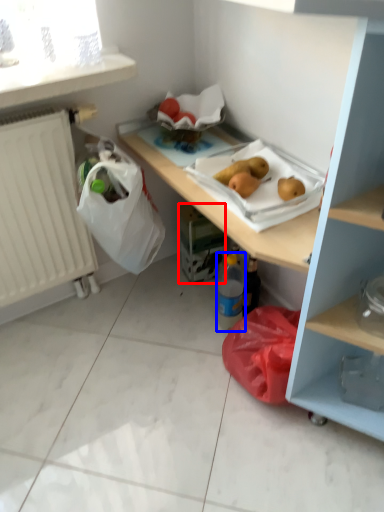
Question: Among these objects, which one is farthest to the camera, carton (highlighted by a red box) or bottle (highlighted by a blue box)?

Choices:
 (A) carton
 (B) bottle

Answer: (A)